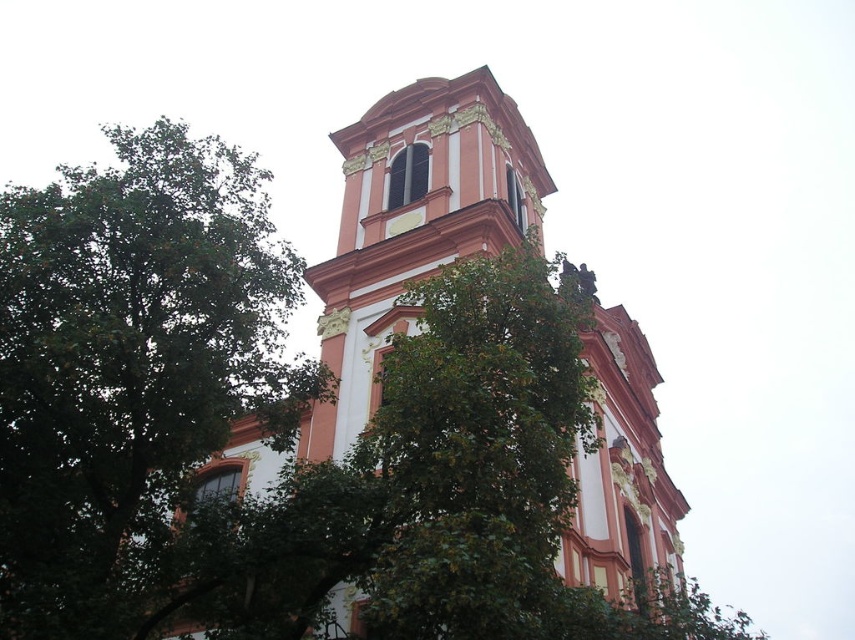
Question: Which of the following is the farthest from the observer?

Choices:
 (A) (357, 284)
 (B) (248, 305)

Answer: (A)

Question: Which point is closer to the camera?

Choices:
 (A) (429, 106)
 (B) (329, 396)

Answer: (B)

Question: Which point is closer to the camera?

Choices:
 (A) green leafy tree at center
 (B) matte orange church at center

Answer: (A)

Question: Does green leafy tree at center appear over matte orange church at center?

Choices:
 (A) yes
 (B) no

Answer: (A)

Question: Does green leafy tree at center have a larger size compared to matte orange church at center?

Choices:
 (A) no
 (B) yes

Answer: (B)

Question: In this image, where is green leafy tree at center located relative to matte orange church at center?

Choices:
 (A) below
 (B) above

Answer: (B)